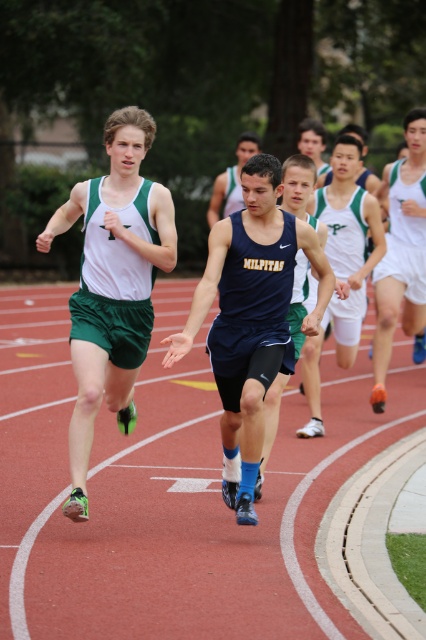
What do you see at coordinates (173, 502) in the screenshot? This screenshot has height=640, width=426. I see `red rubber track at center` at bounding box center [173, 502].

Between red rubber track at center and navy blue athletic tank top at center, which one is positioned higher?

navy blue athletic tank top at center is higher up.

Between point (192, 356) and point (253, 362), which one is positioned in front?

Positioned in front is point (253, 362).

This screenshot has height=640, width=426. Find the location of `red rubber track at center`. red rubber track at center is located at coordinates (173, 502).

Is matte green shorts at left to the right of dark blue athletic uniform at center from the viewer's perspective?

No, matte green shorts at left is not to the right of dark blue athletic uniform at center.

Looking at this image, who is higher up, matte green shorts at left or dark blue athletic uniform at center?

dark blue athletic uniform at center is higher up.

Where is `matte green shorts at left`? The height and width of the screenshot is (640, 426). matte green shorts at left is located at coordinates pyautogui.click(x=112, y=284).

Can you confirm if matte green shorts at left is thinner than matte green shorts at center?

Yes.

Does matte green shorts at left come behind matte green shorts at center?

No.

I want to click on matte green shorts at left, so click(112, 284).

Find the location of a particular element. The width and height of the screenshot is (426, 640). matte green shorts at left is located at coordinates (112, 284).